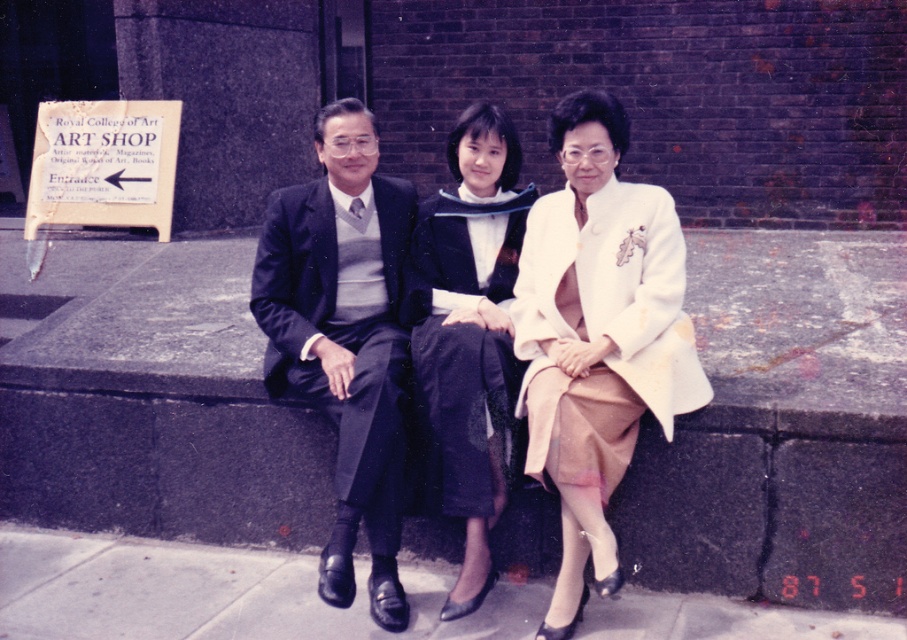
Who is taller, smooth concrete pavement at lower center or dark blue suit at center?

Standing taller between the two is dark blue suit at center.

This screenshot has width=907, height=640. Find the location of `smooth concrete pavement at lower center`. smooth concrete pavement at lower center is located at coordinates (216, 593).

Does point (556, 314) lie in front of point (354, 390)?

No, (556, 314) is further to viewer.

Measure the distance from white satin jacket at center to dark blue suit at center.

white satin jacket at center and dark blue suit at center are 71.22 centimeters apart.

Does point (542, 422) come closer to viewer compared to point (363, 278)?

Yes.

The height and width of the screenshot is (640, 907). In order to click on white satin jacket at center in this screenshot , I will do `click(597, 336)`.

Image resolution: width=907 pixels, height=640 pixels. What are the coordinates of `matte black suit at center` in the screenshot? It's located at (558, 346).